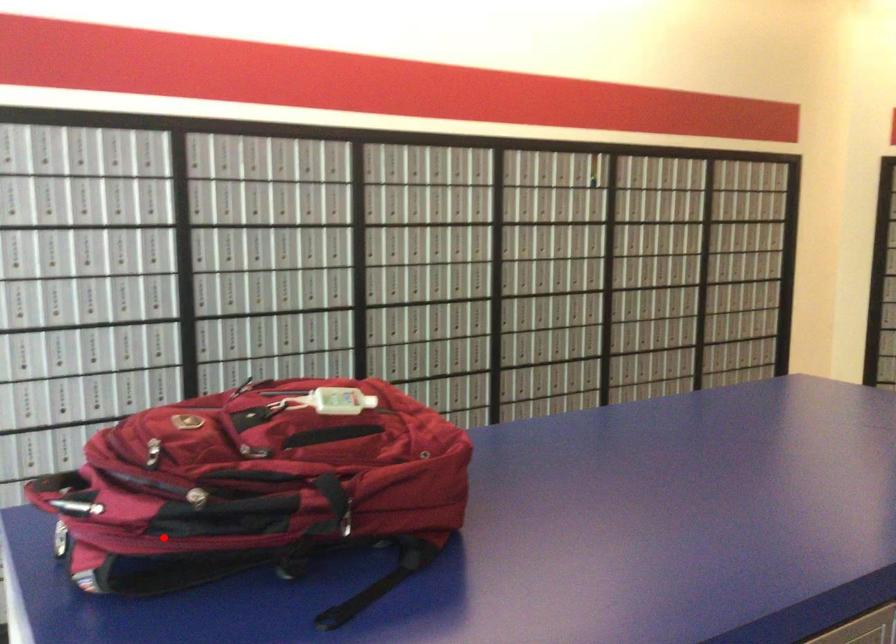
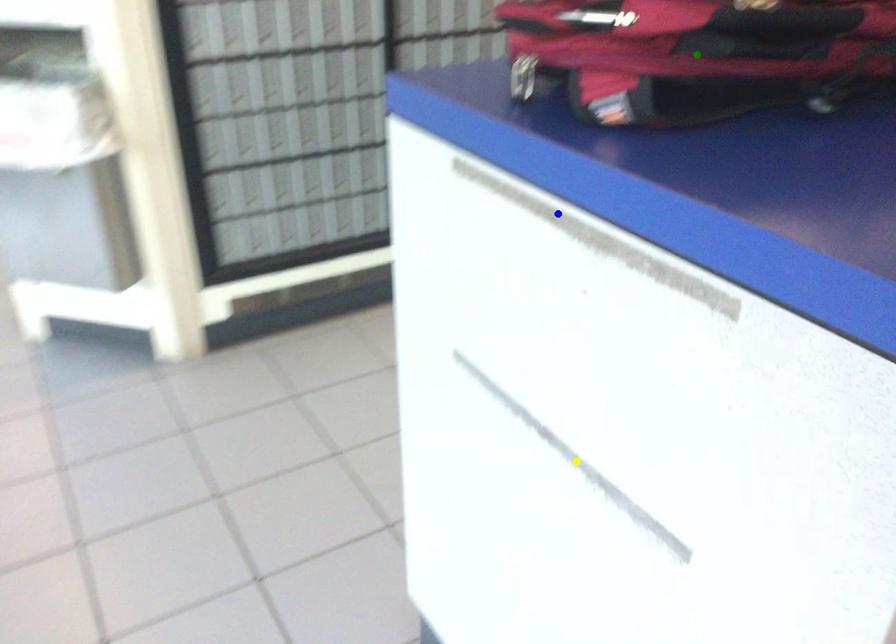
Question: I am providing you with two images of the same scene from different viewpoints. A red point is marked on the first image. You are given multiple points on the second image. In image 2, which mark is for the same physical point as the one in image 1?

Choices:
 (A) green point
 (B) blue point
 (C) yellow point

Answer: (A)